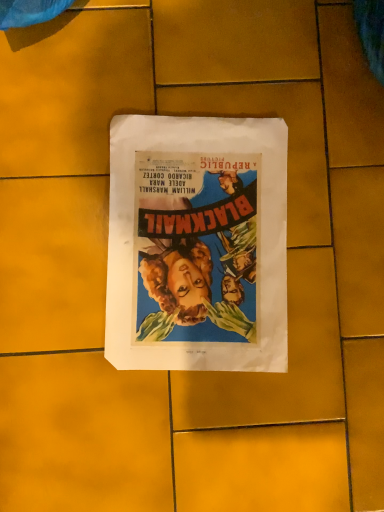
This screenshot has height=512, width=384. What are the coordinates of `empty space that is ontop of matte paper poster at center (from a real-world perspective)` in the screenshot? It's located at (197, 238).